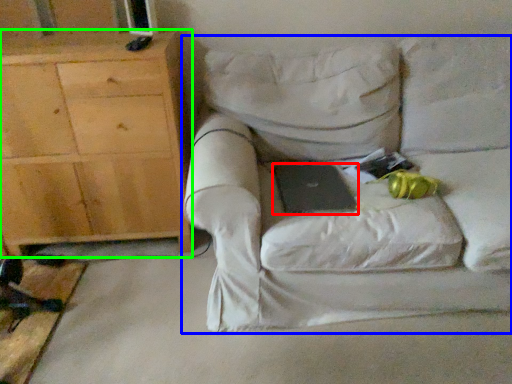
Question: Based on their relative distances, which object is nearer to laptop (highlighted by a red box)? Choose from chair (highlighted by a blue box) and cabinetry (highlighted by a green box).

Choices:
 (A) chair
 (B) cabinetry

Answer: (A)